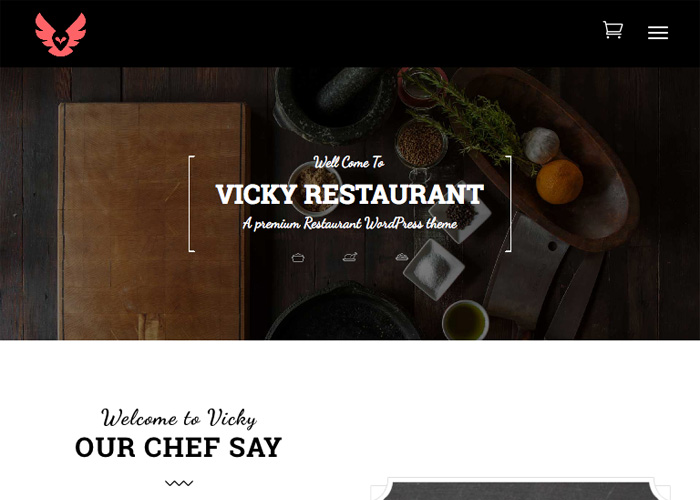
At what (x,y) coordinates should I click in order to perform the action: click on spice in a bowl. Please return your answer as a coordinate pair (x, y). The image size is (700, 500). Looking at the image, I should click on (419, 147).